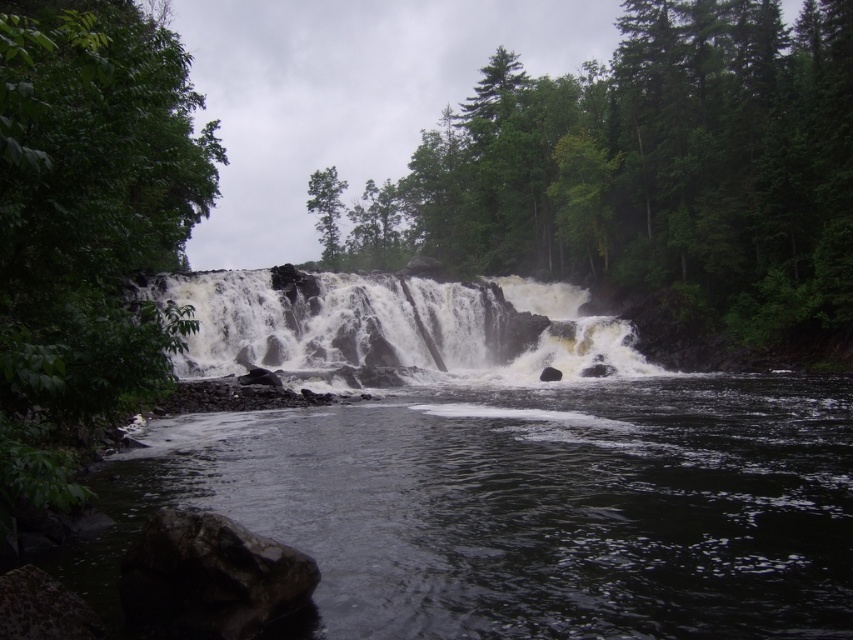
You are standing at the origin point in the waterfall scene. The dark gray rock at lower left is marked at coordinates. Can you determine its exact location using the coordinate system provided?

The dark gray rock at lower left is exactly at point (x=207, y=579) in the coordinate system.

You are a hiker trying to navigate through the forest. You see a green leafy tree at left and a green leafy tree at upper center. Which tree is positioned more to the right side of the scene?

The green leafy tree at left is positioned more to the right compared to the green leafy tree at upper center, as it is located to the right of the latter.

You are a hiker trying to cross the river near the waterfall. You see the dark gray rock at lower left and the green leafy tree at upper center in your path. Which object is narrower, and can you use the narrower one to step on safely?

The dark gray rock at lower left has a lesser width compared to the green leafy tree at upper center, so it is narrower. However, stepping on the narrow dark gray rock at lower left may be risky due to its small size and the turbulent water around it. It is safer to avoid stepping on it and find a wider, more stable surface.